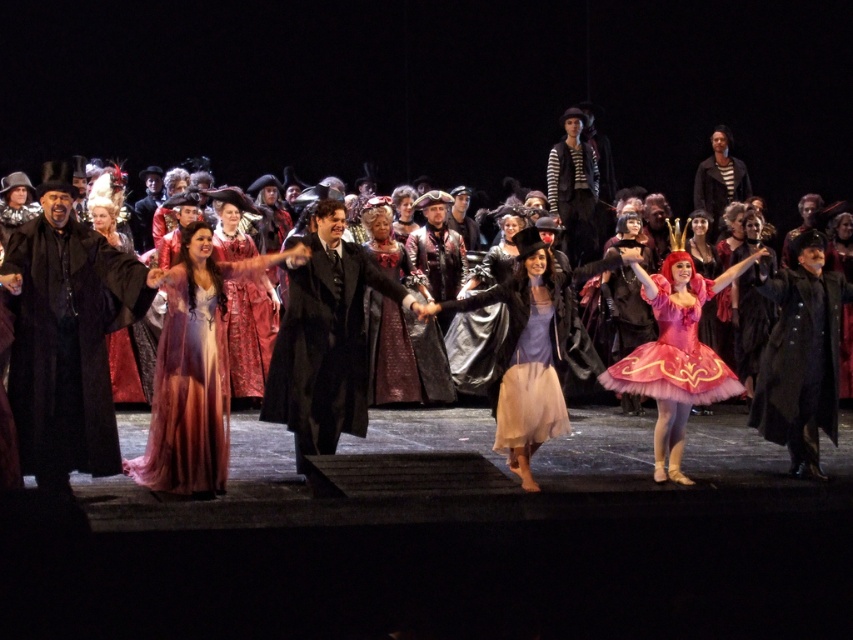
Question: Among these objects, which one is nearest to the camera?

Choices:
 (A) matte purple dress at center
 (B) translucent purple gown at center
 (C) velvet black robe at left

Answer: (C)

Question: Is pink tulle tutu at center to the right of velvet maroon dress at center from the viewer's perspective?

Choices:
 (A) yes
 (B) no

Answer: (A)

Question: Is pink tulle tutu at center closer to camera compared to light beige chiffon dress at center?

Choices:
 (A) yes
 (B) no

Answer: (B)

Question: Is shiny black coat at center thinner than pink tulle tutu at center?

Choices:
 (A) yes
 (B) no

Answer: (A)

Question: Which object appears closest to the camera in this image?

Choices:
 (A) matte purple dress at center
 (B) light beige chiffon dress at center
 (C) silky purple gown at center

Answer: (C)

Question: Which point is closer to the camera taking this photo?

Choices:
 (A) (544, 372)
 (B) (126, 282)

Answer: (B)